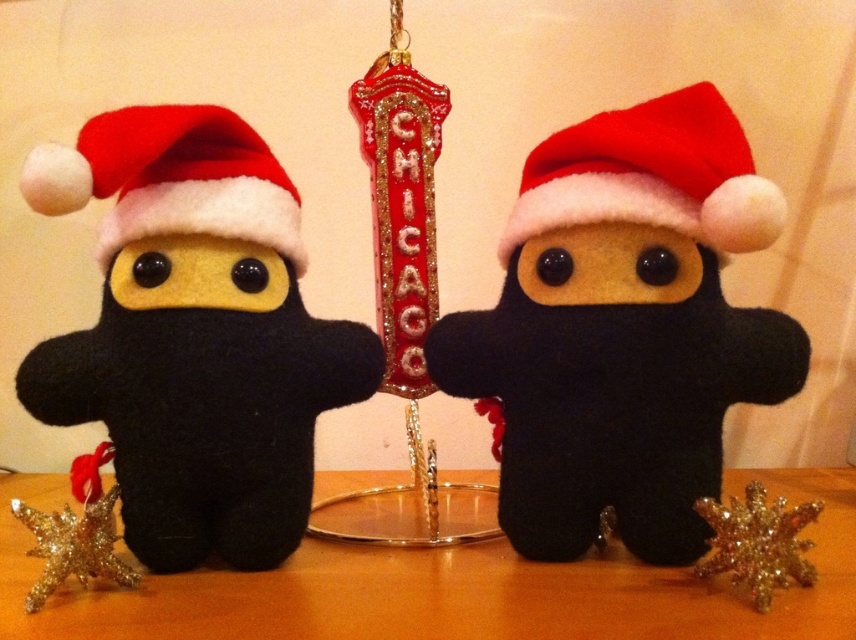
Question: Which point is farther to the camera?

Choices:
 (A) gold glitter star at lower right
 (B) shiny metallic star at lower left
 (C) wooden table at center

Answer: (B)

Question: Estimate the real-world distances between objects in this image. Which object is farther from the matte black ninja at left?

Choices:
 (A) shiny metallic star at lower left
 (B) matte black ninja at center
 (C) wooden table at center

Answer: (B)

Question: Which point is farther to the camera?

Choices:
 (A) (74, 369)
 (B) (502, 586)

Answer: (A)

Question: Is wooden table at center below shiny metallic star at lower left?

Choices:
 (A) yes
 (B) no

Answer: (B)

Question: Does matte black ninja at left appear over fuzzy felt santa hat at left?

Choices:
 (A) yes
 (B) no

Answer: (B)

Question: Is felt santa hat at center behind shiny metallic star at lower left?

Choices:
 (A) yes
 (B) no

Answer: (A)